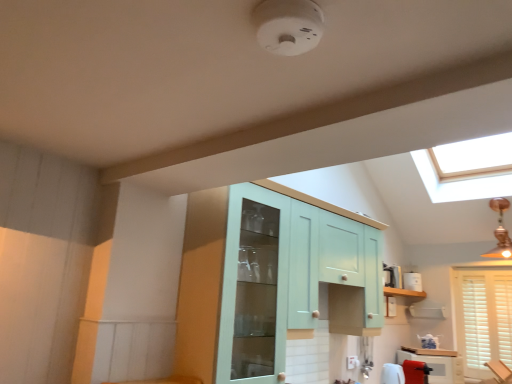
Question: From the image's perspective, would you say white wooden blinds at lower right is positioned over matte white cabinet at lower right, the second cabinetry from the top?

Choices:
 (A) yes
 (B) no

Answer: (A)

Question: Does white wooden blinds at lower right appear on the right side of matte white cabinet at lower right, the second cabinetry from the top?

Choices:
 (A) yes
 (B) no

Answer: (A)

Question: From the image's perspective, is white wooden blinds at lower right beneath matte white cabinet at lower right, which is the 2th cabinetry in left-to-right order?

Choices:
 (A) no
 (B) yes

Answer: (A)

Question: Does white wooden blinds at lower right have a lesser width compared to matte white cabinet at lower right, which is the first cabinetry from right to left?

Choices:
 (A) no
 (B) yes

Answer: (B)

Question: Is white wooden blinds at lower right looking in the opposite direction of matte white cabinet at lower right, which is the 2th cabinetry in left-to-right order?

Choices:
 (A) no
 (B) yes

Answer: (A)

Question: From the image's perspective, is white glossy counter top at lower right positioned above or below light teal glass cabinet at center, marked as the first cabinetry in a front-to-back arrangement?

Choices:
 (A) below
 (B) above

Answer: (A)

Question: In terms of size, does white glossy counter top at lower right appear bigger or smaller than light teal glass cabinet at center, the first cabinetry from the top?

Choices:
 (A) small
 (B) big

Answer: (A)

Question: Is white glossy counter top at lower right situated inside light teal glass cabinet at center, marked as the first cabinetry in a front-to-back arrangement, or outside?

Choices:
 (A) inside
 (B) outside

Answer: (B)

Question: Is white glossy counter top at lower right to the left or to the right of light teal glass cabinet at center, arranged as the second cabinetry when ordered from the bottom, in the image?

Choices:
 (A) right
 (B) left

Answer: (A)

Question: Is light teal glass cabinet at center, which is the first cabinetry from left to right, in front of or behind white glossy counter top at lower right in the image?

Choices:
 (A) behind
 (B) front

Answer: (B)

Question: From a real-world perspective, is light teal glass cabinet at center, marked as the first cabinetry in a front-to-back arrangement, physically located above or below white glossy counter top at lower right?

Choices:
 (A) above
 (B) below

Answer: (A)

Question: Considering the positions of light teal glass cabinet at center, the first cabinetry from the top, and white glossy counter top at lower right in the image, is light teal glass cabinet at center, the first cabinetry from the top, taller or shorter than white glossy counter top at lower right?

Choices:
 (A) tall
 (B) short

Answer: (A)

Question: From the image's perspective, is light teal glass cabinet at center, the first cabinetry from the top, located above or below white glossy counter top at lower right?

Choices:
 (A) below
 (B) above

Answer: (B)

Question: Is light teal glass cabinet at center, which is the first cabinetry from left to right, spatially inside white plastic toaster at right, or outside of it?

Choices:
 (A) outside
 (B) inside

Answer: (A)

Question: Based on their sizes in the image, would you say light teal glass cabinet at center, marked as the second cabinetry in a back-to-front arrangement, is bigger or smaller than white plastic toaster at right?

Choices:
 (A) big
 (B) small

Answer: (A)